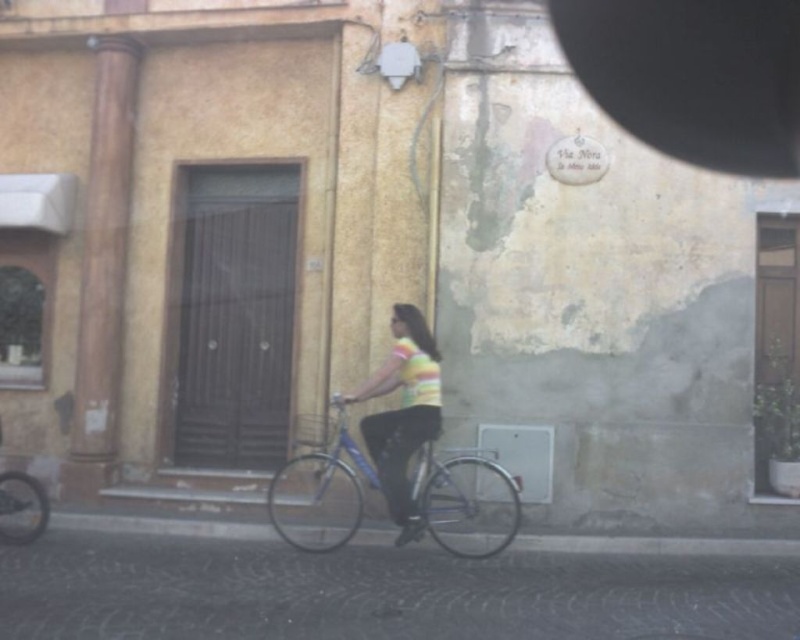
You are standing on the sidewalk and see the blue metallic bicycle at center and the striped fabric shirt at center. Which object is closer to you?

→ The blue metallic bicycle at center is closer to you because it is further to the viewer than the striped fabric shirt at center.

You are a pedestrian standing on the sidewalk and see the blue metallic bicycle at center and the striped fabric shirt at center. Which object is higher from the ground?

The striped fabric shirt at center is higher from the ground than the blue metallic bicycle at center because the blue metallic bicycle at center is below striped fabric shirt at center.